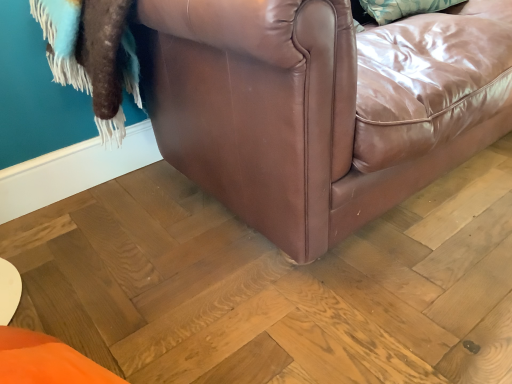
I want to click on brown leather couch at center, so click(320, 105).

Measure the distance between brown leather couch at center and camera.

25.69 inches.

What do you see at coordinates (320, 105) in the screenshot? I see `brown leather couch at center` at bounding box center [320, 105].

Locate an element on the screen. This screenshot has width=512, height=384. brown leather couch at center is located at coordinates (320, 105).